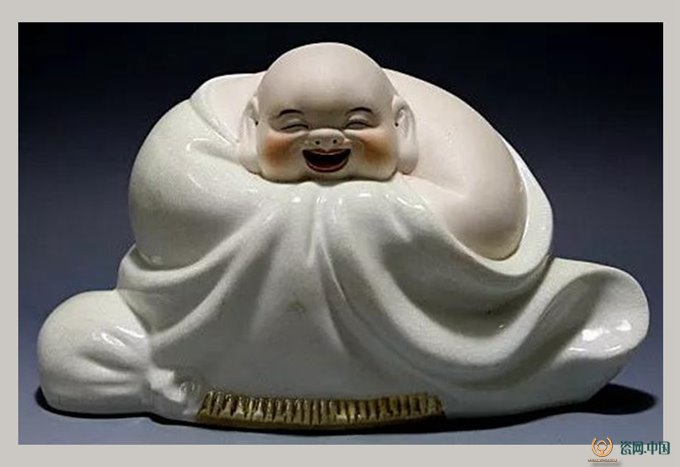
Find the location of a particular element. gold trim is located at coordinates (321, 416).